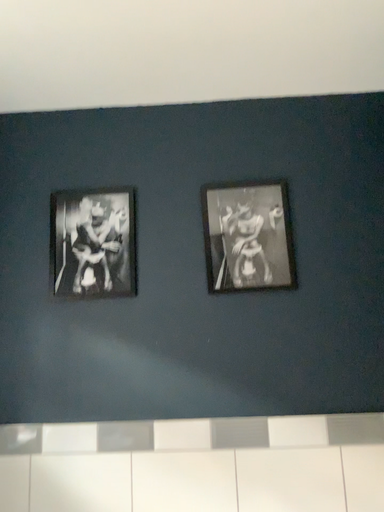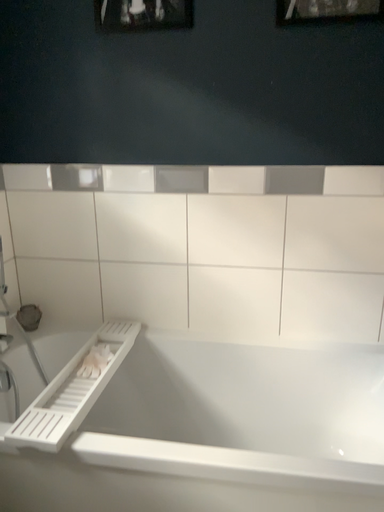
Question: Which way did the camera rotate in the video?

Choices:
 (A) rotated upward
 (B) rotated downward

Answer: (B)